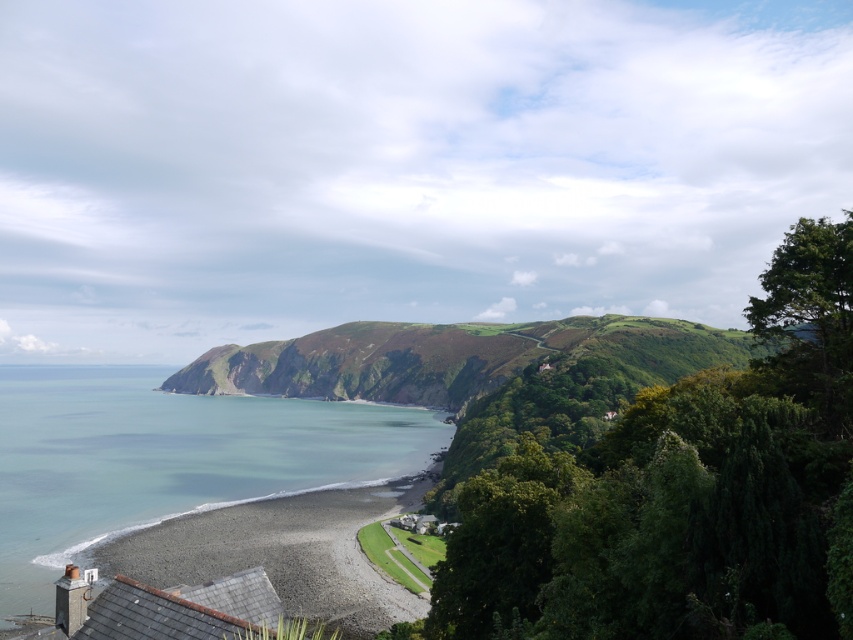
Question: Is blue water at lower left positioned at the back of gray gravel beach at lower left?

Choices:
 (A) yes
 (B) no

Answer: (A)

Question: Which point is closer to the camera?

Choices:
 (A) gray gravel beach at lower left
 (B) blue water at lower left

Answer: (A)

Question: Can you confirm if blue water at lower left is wider than gray gravel beach at lower left?

Choices:
 (A) yes
 (B) no

Answer: (A)

Question: Among these points, which one is nearest to the camera?

Choices:
 (A) (277, 490)
 (B) (218, 513)

Answer: (B)

Question: Can you confirm if blue water at lower left is wider than gray gravel beach at lower left?

Choices:
 (A) no
 (B) yes

Answer: (B)

Question: Which object is farther from the camera taking this photo?

Choices:
 (A) gray gravel beach at lower left
 (B) blue water at lower left

Answer: (B)